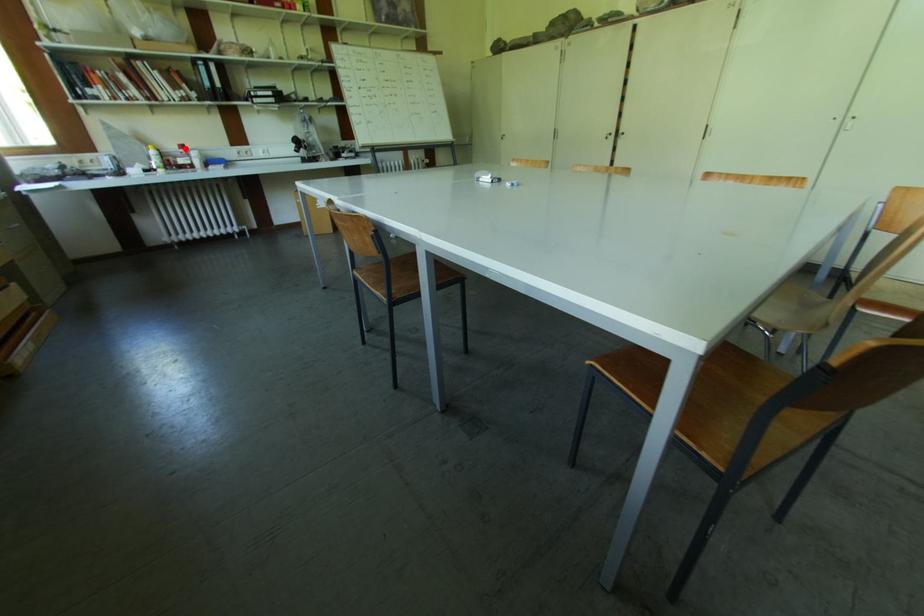
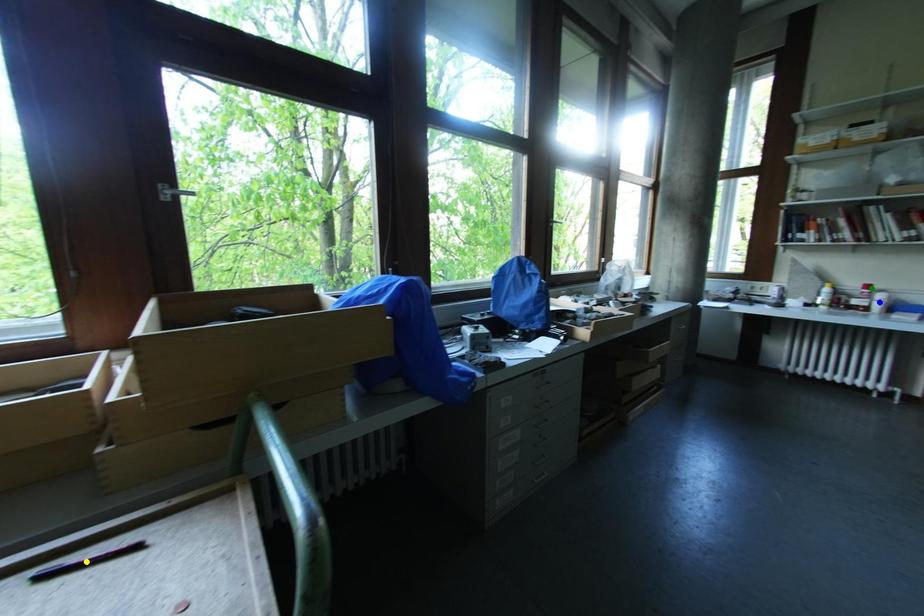
Question: I am providing you with two images of the same scene from different viewpoints. A red point is marked on the first image. You are given multiple points on the second image. In image 2, which mark is for the same physical point as the one in image 1?

Choices:
 (A) yellow point
 (B) green point
 (C) blue point

Answer: (B)